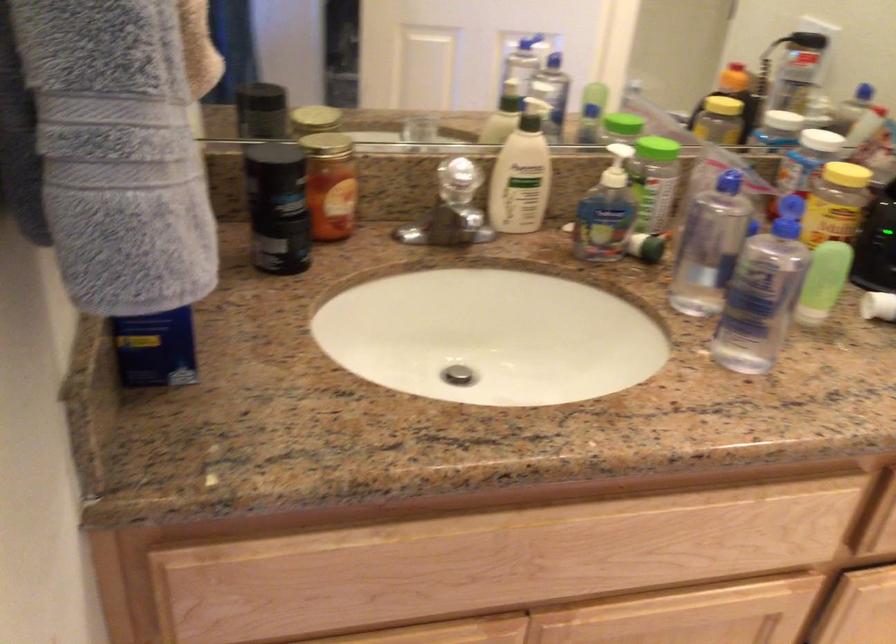
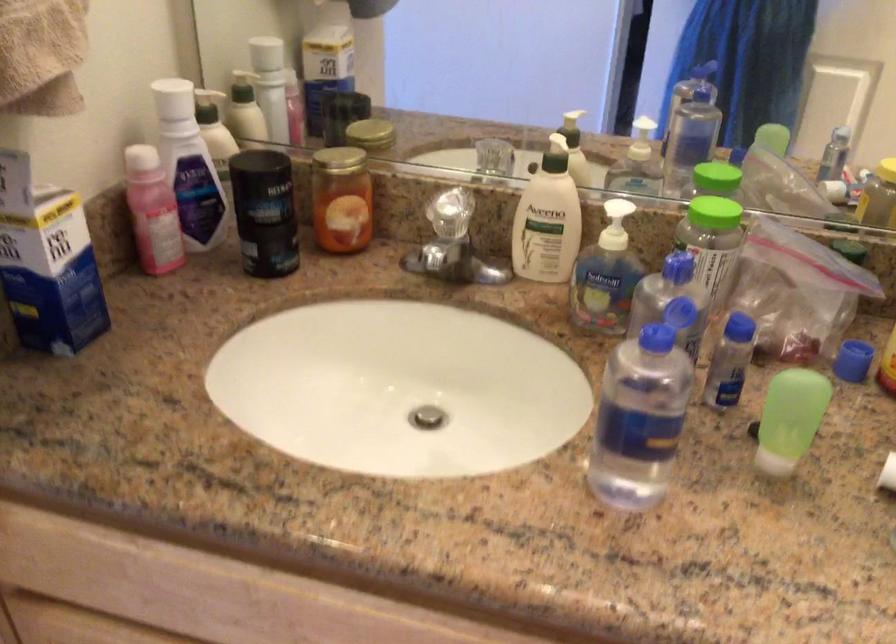
Find the pixel in the second image that matches (x=633, y=124) in the first image.

(716, 178)